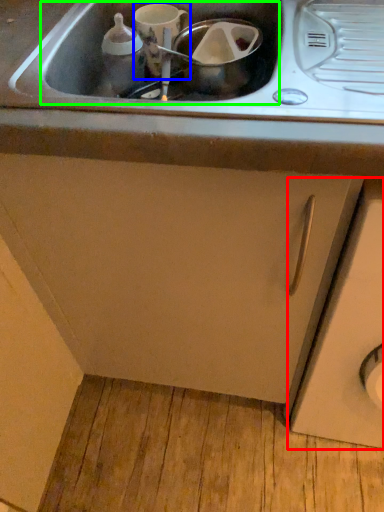
Question: Which object is positioned farthest from cabinetry (highlighted by a red box)? Select from appliance (highlighted by a blue box) and sink (highlighted by a green box).

Choices:
 (A) appliance
 (B) sink

Answer: (A)